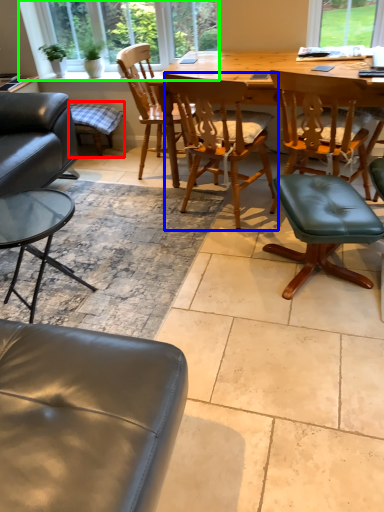
Question: Which object is positioned closest to bar stool (highlighted by a red box)? Select from chair (highlighted by a blue box) and window frame (highlighted by a green box).

Choices:
 (A) chair
 (B) window frame

Answer: (B)